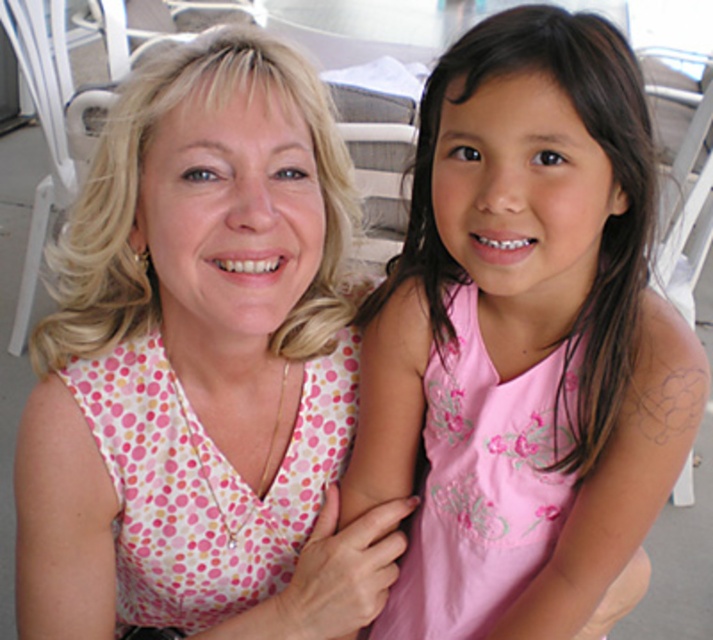
You are a photographer who needs to adjust the lighting between the pink floral dress at center and the pink embroidered dress at center. Since the distance between them is 1.81 inches, can you fit a small reflector between them to evenly distribute light?

The distance between the pink floral dress at center and the pink embroidered dress at center is 1.81 inches. A small reflector typically requires at least 2 inches of space to be placed between subjects for effective lighting. Therefore, it won not fit between them.

Based on the scene description, which clothing item is closer to the camera between the pink dotted blouse at center and the pink embroidered dress at center?

The pink dotted blouse at center is in front of the pink embroidered dress at center, so the pink dotted blouse at center is closer to the camera.

Consider the image. Based on the scene description, which clothing item is taller between the pink floral dress at center and the pink dotted blouse at center?

The pink floral dress at center is much taller than the pink dotted blouse at center.